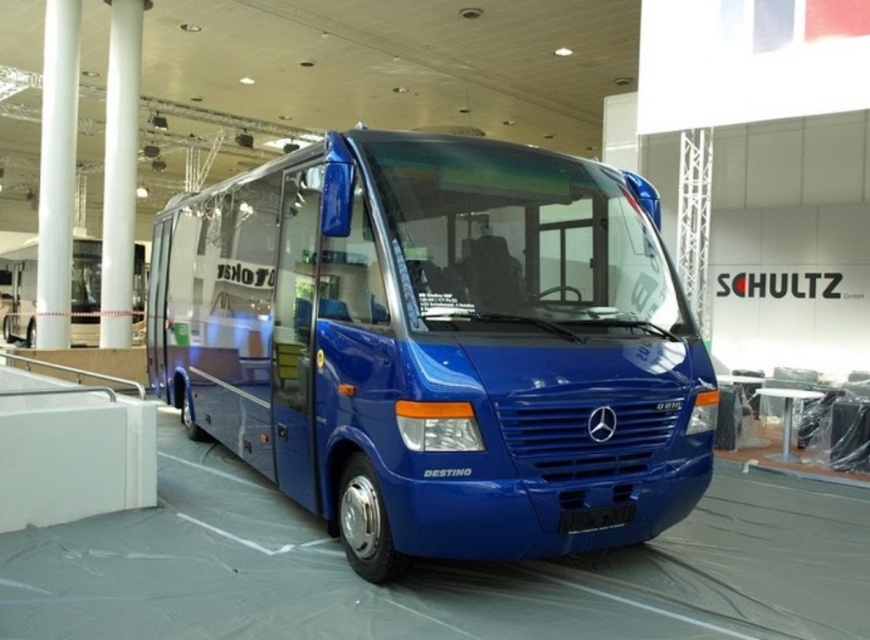
Question: Which object is positioned closest to the white glossy pillar at center?

Choices:
 (A) white glossy pillar at left
 (B) glossy blue bus at center

Answer: (A)

Question: Is white glossy pillar at left positioned in front of white glossy pillar at center?

Choices:
 (A) yes
 (B) no

Answer: (A)

Question: Does white glossy pillar at left appear on the right side of white glossy pillar at center?

Choices:
 (A) yes
 (B) no

Answer: (B)

Question: Estimate the real-world distances between objects in this image. Which object is farther from the white glossy pillar at left?

Choices:
 (A) white glossy pillar at center
 (B) glossy blue bus at center

Answer: (B)

Question: Which of the following is the closest to the observer?

Choices:
 (A) (52, 84)
 (B) (104, 225)
 (C) (407, 176)

Answer: (C)

Question: Observing the image, what is the correct spatial positioning of glossy blue bus at center in reference to white glossy pillar at center?

Choices:
 (A) left
 (B) right

Answer: (B)